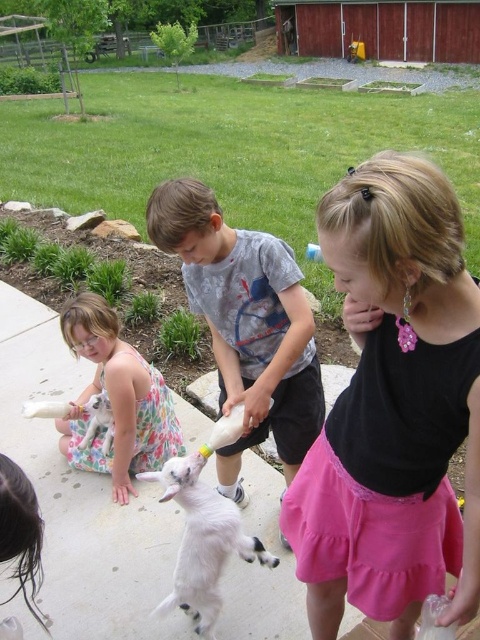
Which is above, matte gray shirt at center or white fluffy lamb at center?

matte gray shirt at center is above.

Is matte gray shirt at center smaller than white fluffy lamb at center?

Actually, matte gray shirt at center might be larger than white fluffy lamb at center.

Is point (288, 483) behind point (228, 536)?

Yes.

The image size is (480, 640). I want to click on matte gray shirt at center, so click(x=245, y=323).

Between point (402, 353) and point (202, 188), which one is positioned in front?

Positioned in front is point (402, 353).

How distant is pink satin skirt at lower right from matte gray shirt at center?

60.93 centimeters

Is point (340, 566) closer to viewer compared to point (199, 291)?

That is True.

You are a GUI agent. You are given a task and a screenshot of the screen. Output one action in this format:
    pyautogui.click(x=<x>, y=<y>)
    Task: Click on the pink satin skirt at lower right
    Image resolution: width=480 pixels, height=640 pixels.
    Given the screenshot: What is the action you would take?
    pyautogui.click(x=394, y=406)

Is point (154, 419) behind point (239, 532)?

Yes, point (154, 419) is farther from viewer.

This screenshot has height=640, width=480. Identify the location of floral dress at lower left. (116, 400).

This screenshot has height=640, width=480. What are the coordinates of `floral dress at lower left` in the screenshot? It's located at (116, 400).